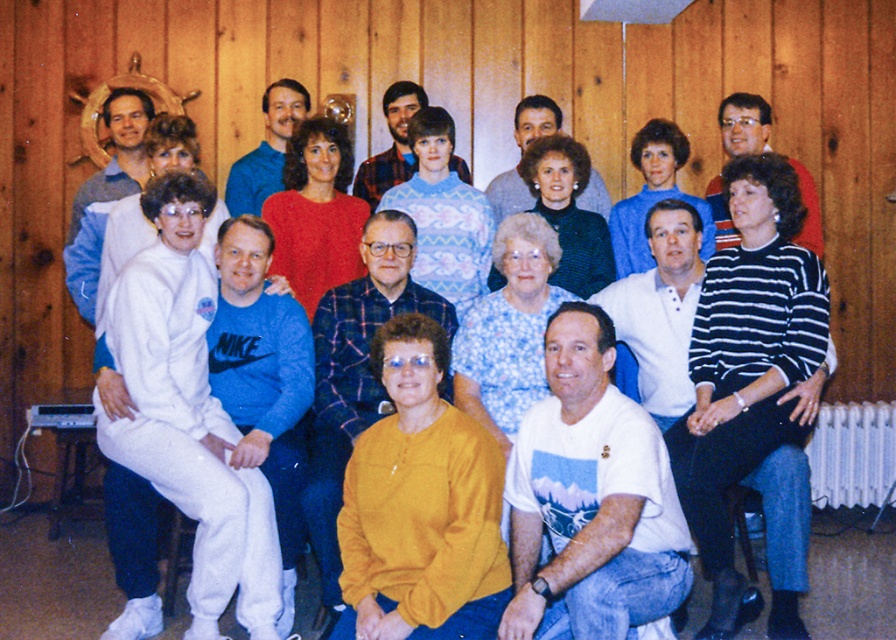
Is white cotton t-shirt at lower center below dark green sweater at center?

Correct, white cotton t-shirt at lower center is located below dark green sweater at center.

Is white cotton t-shirt at lower center bigger than dark green sweater at center?

Correct, white cotton t-shirt at lower center is larger in size than dark green sweater at center.

Image resolution: width=896 pixels, height=640 pixels. What are the coordinates of `white cotton t-shirt at lower center` in the screenshot? It's located at (591, 497).

Who is positioned more to the right, white cotton t-shirt at lower center or red sweater at center?

Positioned to the right is white cotton t-shirt at lower center.

Consider the image. Is white cotton t-shirt at lower center bigger than red sweater at center?

Indeed, white cotton t-shirt at lower center has a larger size compared to red sweater at center.

Describe the element at coordinates (591, 497) in the screenshot. I see `white cotton t-shirt at lower center` at that location.

Find the location of a particular element. white cotton t-shirt at lower center is located at coordinates (591, 497).

This screenshot has height=640, width=896. I want to click on white cotton t-shirt at lower center, so click(x=591, y=497).

Describe the element at coordinates (591, 497) in the screenshot. I see `white cotton t-shirt at lower center` at that location.

Find the location of a particular element. white cotton t-shirt at lower center is located at coordinates (591, 497).